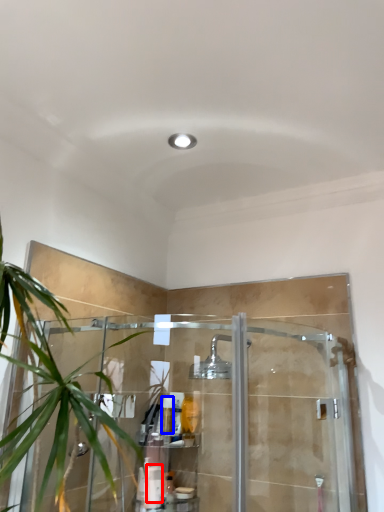
Question: Which object is closer to the camera taking this photo, toiletry (highlighted by a red box) or toiletry (highlighted by a blue box)?

Choices:
 (A) toiletry
 (B) toiletry

Answer: (A)